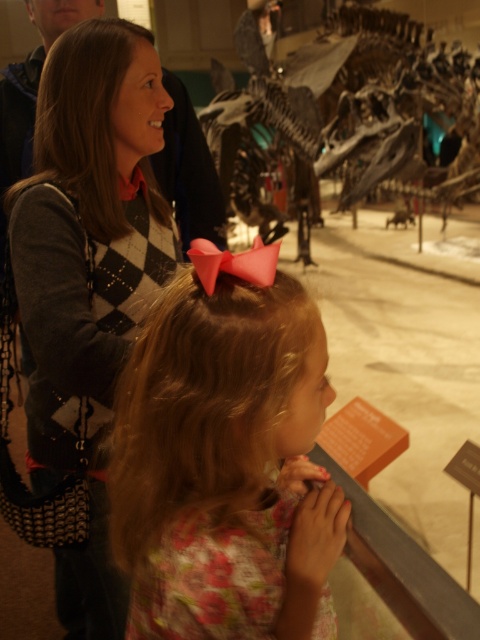
Measure the distance from pink satin bow at center to shiny metallic dinosaur at center.

pink satin bow at center and shiny metallic dinosaur at center are 17.33 feet apart.

Which is above, pink satin bow at center or shiny metallic dinosaur at center?

shiny metallic dinosaur at center is higher up.

I want to click on pink satin bow at center, so click(225, 460).

Locate an element on the screen. The height and width of the screenshot is (640, 480). pink satin bow at center is located at coordinates (225, 460).

Looking at this image, between pink satin bow at center and argyle sweater at upper left, which one is positioned higher?

Positioned higher is pink satin bow at center.

Who is more forward, (x=301, y=326) or (x=91, y=364)?

Positioned in front is point (x=301, y=326).

Measure the distance between point (216,394) and camera.

Point (216,394) is 23.46 inches from camera.

The image size is (480, 640). What are the coordinates of `pink satin bow at center` in the screenshot? It's located at (225, 460).

In the scene shown: Is argyle sweater at upper left shorter than shiny metallic dinosaur at center?

No, argyle sweater at upper left is not shorter than shiny metallic dinosaur at center.

Does argyle sweater at upper left lie behind shiny metallic dinosaur at center?

No, it is in front of shiny metallic dinosaur at center.

Measure the distance between point (88,132) and camera.

Point (88,132) is 3.75 feet away from camera.

Where is `argyle sweater at upper left`? The width and height of the screenshot is (480, 640). argyle sweater at upper left is located at coordinates (85, 276).